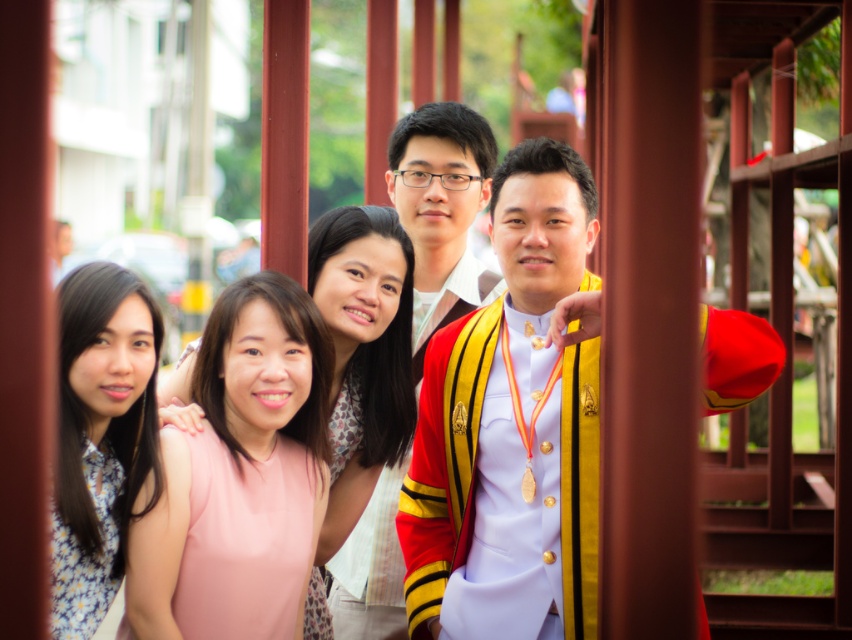
Can you confirm if floral print dress at left is thinner than yellow striped sash at center?

Indeed, floral print dress at left has a lesser width compared to yellow striped sash at center.

Which is behind, point (81, 360) or point (452, 225)?

Point (452, 225)

The width and height of the screenshot is (852, 640). Describe the element at coordinates (101, 436) in the screenshot. I see `floral print dress at left` at that location.

Locate an element on the screen. The width and height of the screenshot is (852, 640). floral print dress at left is located at coordinates [x=101, y=436].

In the scene shown: Does red velvet suit at center have a larger size compared to floral print dress at left?

Yes, red velvet suit at center is bigger than floral print dress at left.

In the scene shown: Can you confirm if red velvet suit at center is positioned below floral print dress at left?

No, red velvet suit at center is not below floral print dress at left.

What do you see at coordinates (513, 426) in the screenshot?
I see `red velvet suit at center` at bounding box center [513, 426].

Find the location of a particular element. red velvet suit at center is located at coordinates (513, 426).

Does floral print dress at left appear on the right side of pink fabric dress at center?

In fact, floral print dress at left is to the left of pink fabric dress at center.

Who is more distant from viewer, (102, 560) or (338, 330)?

The point (338, 330) is more distant.

Which is in front, point (153, 342) or point (350, 417)?

Point (153, 342)

This screenshot has width=852, height=640. Find the location of `floral print dress at left`. floral print dress at left is located at coordinates (101, 436).